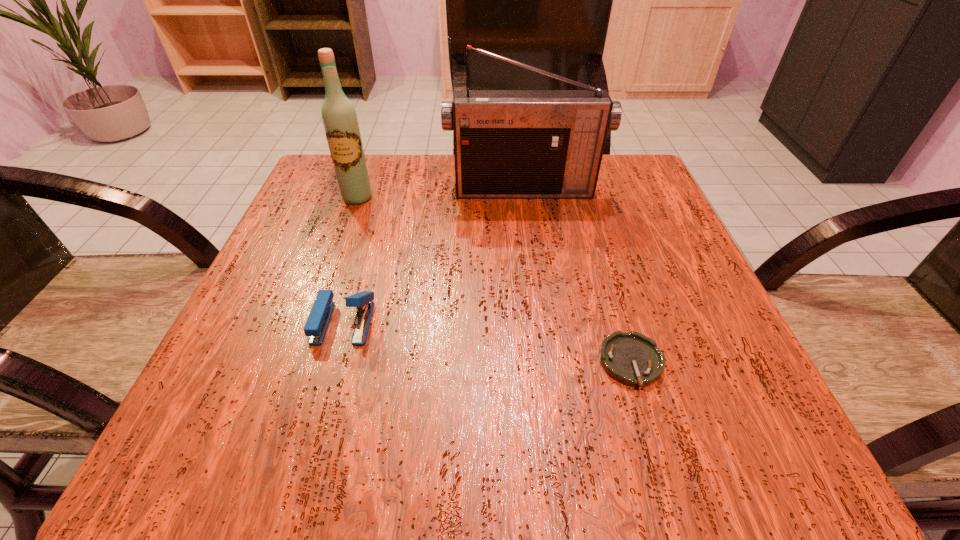
Where is `blank area at the far left corner`? This screenshot has height=540, width=960. blank area at the far left corner is located at coordinates (315, 187).

Locate an element on the screen. The height and width of the screenshot is (540, 960). blank space at the far right corner of the desktop is located at coordinates tap(591, 210).

Find the location of `free location at the near right corner`. free location at the near right corner is located at coordinates (744, 418).

Identify the location of vacant region between the radio receiver and the stapler. (434, 255).

At what (x,y) coordinates should I click in order to perform the action: click on empty space between the third tallest object and the radio receiver. Please return your answer as a coordinate pair (x, y). This screenshot has height=540, width=960. Looking at the image, I should click on (434, 255).

What are the coordinates of `unoccupied position between the shortest object and the wine bottle` in the screenshot? It's located at (494, 280).

Identify the location of unoccupied area between the shortest object and the third tallest object. (488, 342).

I want to click on blank region between the wine bottle and the radio receiver, so click(x=441, y=193).

At what (x,y) coordinates should I click in order to perform the action: click on free spot between the wine bottle and the radio receiver. Please return your answer as a coordinate pair (x, y). This screenshot has width=960, height=540. Looking at the image, I should click on (441, 193).

Locate an element on the screen. The width and height of the screenshot is (960, 540). vacant space that's between the radio receiver and the ashtray is located at coordinates (577, 276).